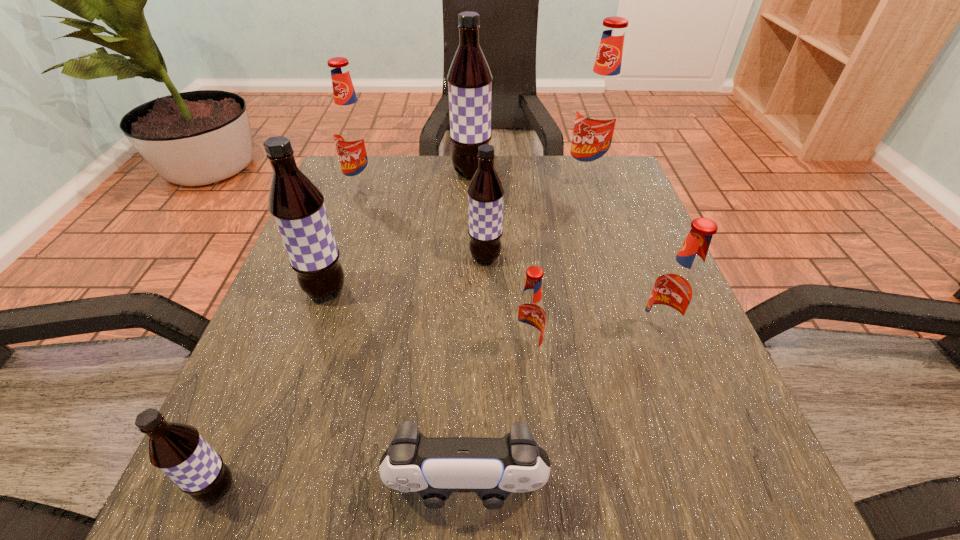
Identify which object is the second nearest to the smallest brown root beer. Please provide its 2D coordinates. Your answer should be formatted as a tuple, i.e. [(x, y)], where the tuple contains the x and y coordinates of a point satisfying the conditions above.

[(297, 206)]

This screenshot has height=540, width=960. Find the location of `the fifth closest root beer to the biggest red root beer`. the fifth closest root beer to the biggest red root beer is located at coordinates (529, 319).

This screenshot has height=540, width=960. In order to click on root beer object that ranks as the fifth closest to the biggest red root beer in this screenshot , I will do `click(529, 319)`.

What are the coordinates of `brown root beer that is the nearest to the fifth nearest object` in the screenshot? It's located at (485, 192).

Select which brown root beer appears as the fourth closest to the leftmost red root beer. Please provide its 2D coordinates. Your answer should be formatted as a tuple, i.e. [(x, y)], where the tuple contains the x and y coordinates of a point satisfying the conditions above.

[(177, 449)]

Where is `the closest red root beer relative to the leftmost red root beer`? Image resolution: width=960 pixels, height=540 pixels. the closest red root beer relative to the leftmost red root beer is located at coordinates (598, 115).

Locate an element on the screen. red root beer that is the third closest to the biggest brown root beer is located at coordinates (529, 319).